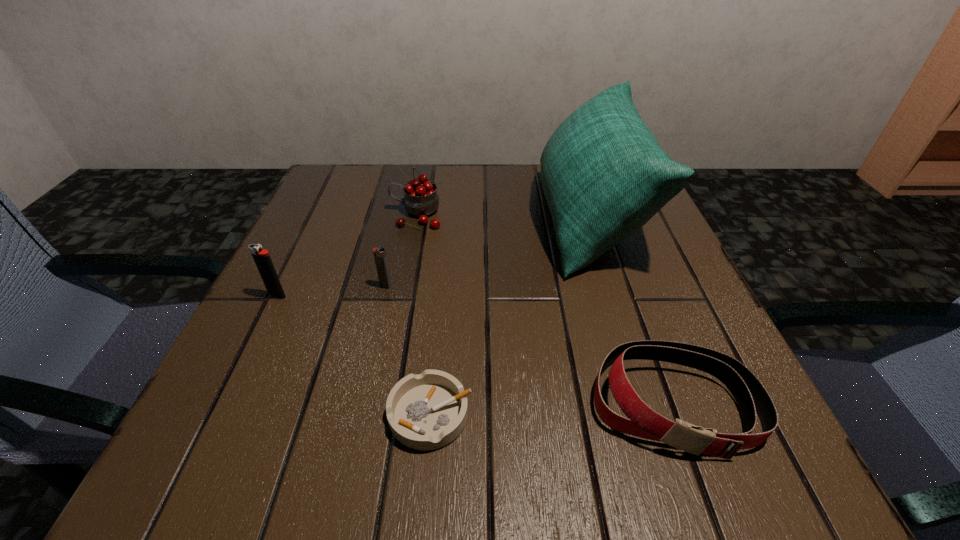
Where is `vacant space that is in between the cherry and the cushion`? This screenshot has height=540, width=960. vacant space that is in between the cherry and the cushion is located at coordinates (503, 217).

Find the location of a particular element. blank region between the dog collar and the leftmost object is located at coordinates (475, 349).

Find the location of a particular element. The width and height of the screenshot is (960, 540). vacant space in between the dog collar and the farther igniter is located at coordinates (530, 345).

Locate which object ranks fourth in proximity to the ashtray. Please provide its 2D coordinates. Your answer should be formatted as a tuple, i.e. [(x, y)], where the tuple contains the x and y coordinates of a point satisfying the conditions above.

[(262, 259)]

Identify which object is the second nearest to the farther igniter. Please provide its 2D coordinates. Your answer should be formatted as a tuple, i.e. [(x, y)], where the tuple contains the x and y coordinates of a point satisfying the conditions above.

[(421, 199)]

Find the location of a particular element. The width and height of the screenshot is (960, 540). vacant area that satisfies the following two spatial constraints: 1. on the back side of the farther igniter; 2. on the right side of the third nearest object is located at coordinates (282, 286).